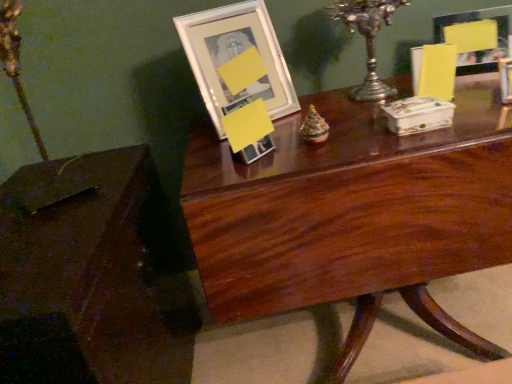
Find the location of a particular element. free space in front of silver metallic candle holder at upper center is located at coordinates (374, 114).